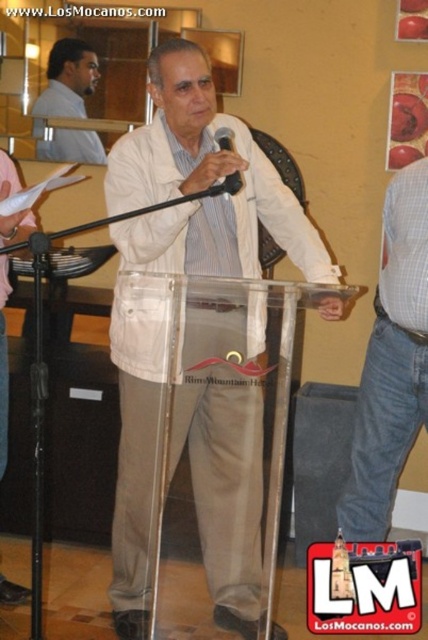
Identify the location of white matte jacket at center. (195, 342).

How far apart are white matte jacket at center and matte white shirt at upper left?

The distance of white matte jacket at center from matte white shirt at upper left is 1.41 meters.

Where is `white matte jacket at center`? This screenshot has width=428, height=640. white matte jacket at center is located at coordinates [195, 342].

In the scene shown: Is denim jeans at right further to the viewer compared to black matte microphone at center?

Yes, denim jeans at right is behind black matte microphone at center.

Image resolution: width=428 pixels, height=640 pixels. What do you see at coordinates (392, 362) in the screenshot? I see `denim jeans at right` at bounding box center [392, 362].

This screenshot has width=428, height=640. What are the coordinates of `denim jeans at right` in the screenshot? It's located at (392, 362).

How distant is white matte jacket at center from matte beige pants at lower right?

They are 35.11 inches apart.

Which of these two, white matte jacket at center or matte beige pants at lower right, stands taller?

With more height is white matte jacket at center.

Describe the element at coordinates (195, 342) in the screenshot. I see `white matte jacket at center` at that location.

Locate an element on the screen. white matte jacket at center is located at coordinates pos(195,342).